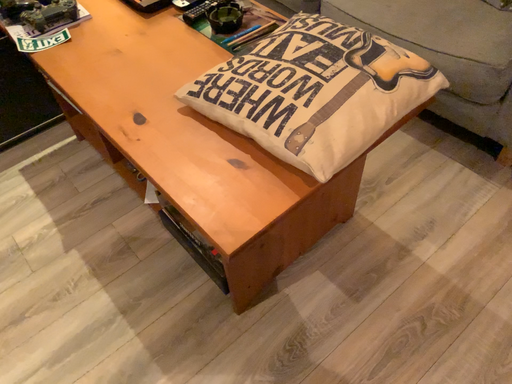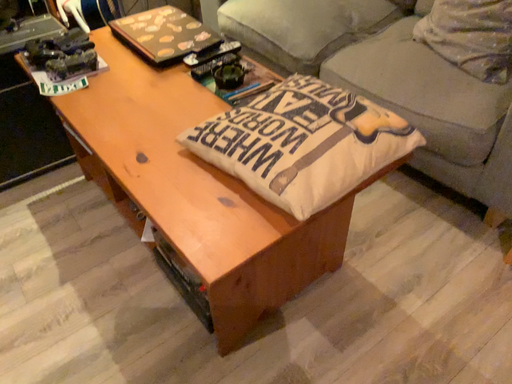
Question: Which way did the camera rotate in the video?

Choices:
 (A) rotated downward
 (B) rotated upward

Answer: (B)